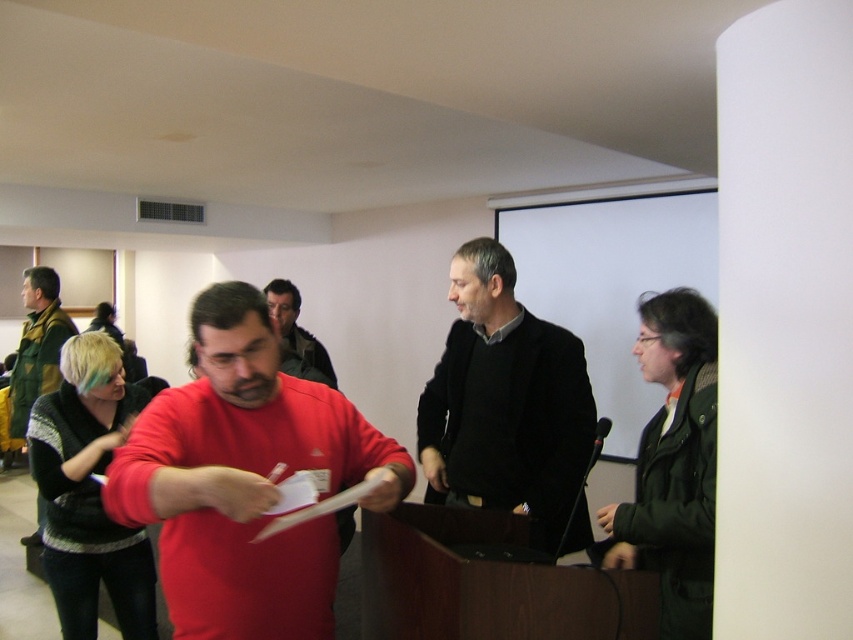
Between black matte sweater at center and green textured jacket at left, which one appears on the left side from the viewer's perspective?

green textured jacket at left

Measure the distance from black matte sweater at center to green textured jacket at left.

black matte sweater at center is 8.78 feet away from green textured jacket at left.

Where is `black matte sweater at center`? black matte sweater at center is located at coordinates (503, 403).

The height and width of the screenshot is (640, 853). Describe the element at coordinates (503, 403) in the screenshot. I see `black matte sweater at center` at that location.

Can you confirm if black matte sweater at center is wider than dark green jacket at right?

Yes.

I want to click on black matte sweater at center, so click(x=503, y=403).

Which of these two, green textured jacket at left or matte black jacket at center, stands shorter?

Standing shorter between the two is matte black jacket at center.

Does point (38, 308) come behind point (289, 285)?

Yes, point (38, 308) is behind point (289, 285).

You are a GUI agent. You are given a task and a screenshot of the screen. Output one action in this format:
    pyautogui.click(x=<x>, y=<y>)
    Task: Click on the green textured jacket at left
    This screenshot has height=640, width=853.
    Given the screenshot: What is the action you would take?
    pyautogui.click(x=38, y=346)